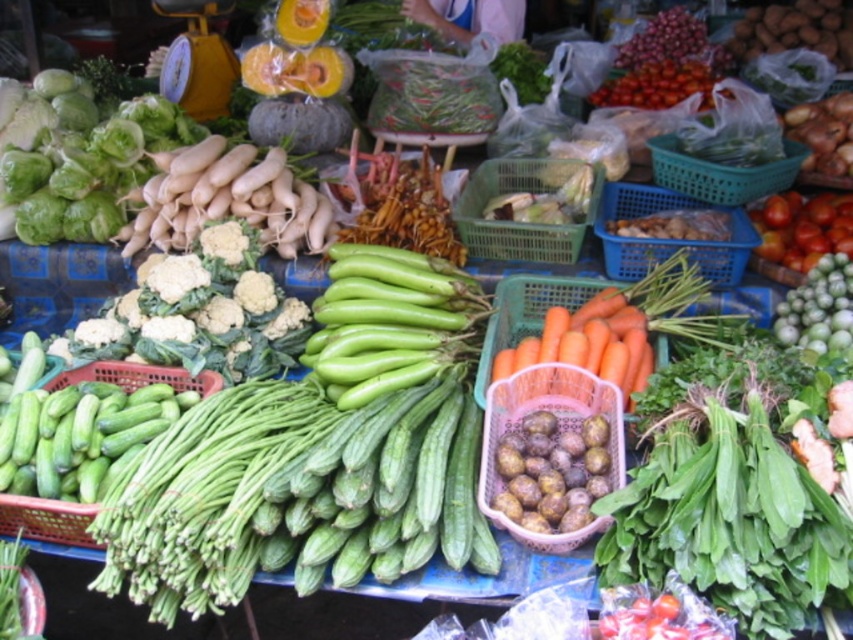
You are a customer at the market stall looking at the green matte eggplant at center and the green plastic cucumbers at left. Which one is positioned more to the left side of the table?

The green plastic cucumbers at left are positioned more to the left side of the table.

You are a customer at the market stall and want to know which item is taller between the green matte eggplant at center and the matte plastic basket at center right. Can you tell me?

The green matte eggplant at center is much taller than the matte plastic basket at center right.

You are a vendor at the market and want to arrange the green matte eggplant at center and the green plastic cucumbers at left on a shelf. If the shelf can only hold items up to 10 cm in width, which item might not fit based on their widths?

The green matte eggplant at center has a larger width than the green plastic cucumbers at left, so the green matte eggplant at center might not fit on the shelf if its width exceeds 10 cm.